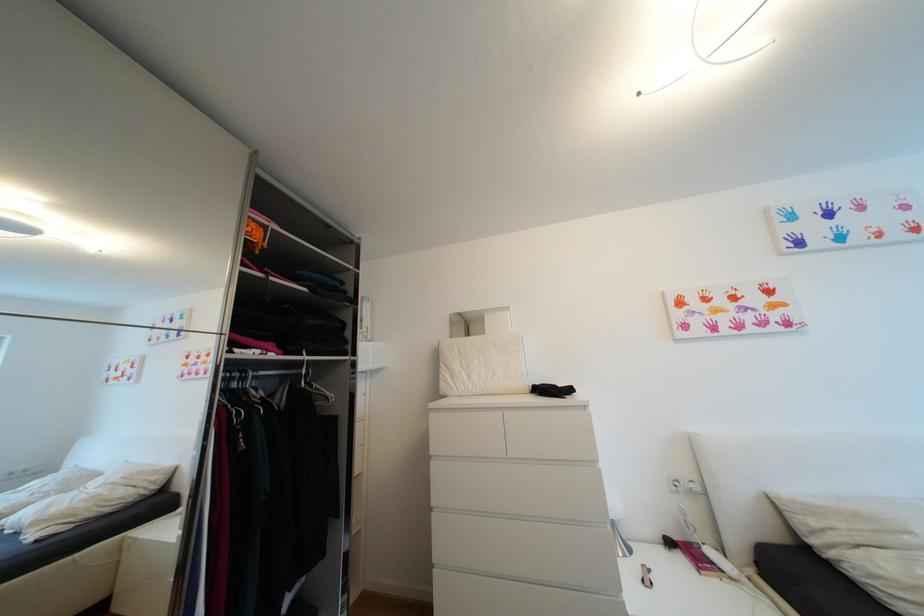
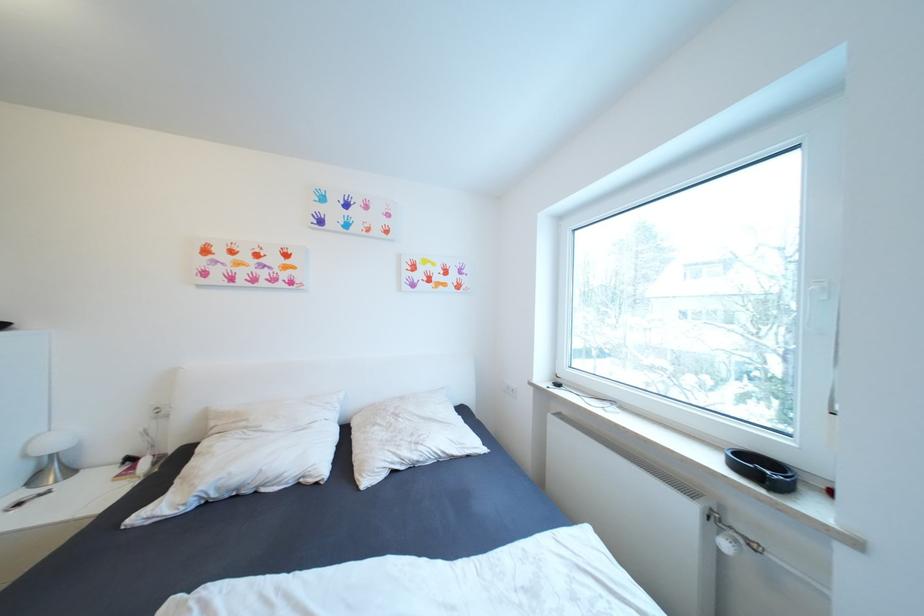
Locate, in the second image, the point that corresponds to (x=821, y=524) in the first image.

(220, 424)